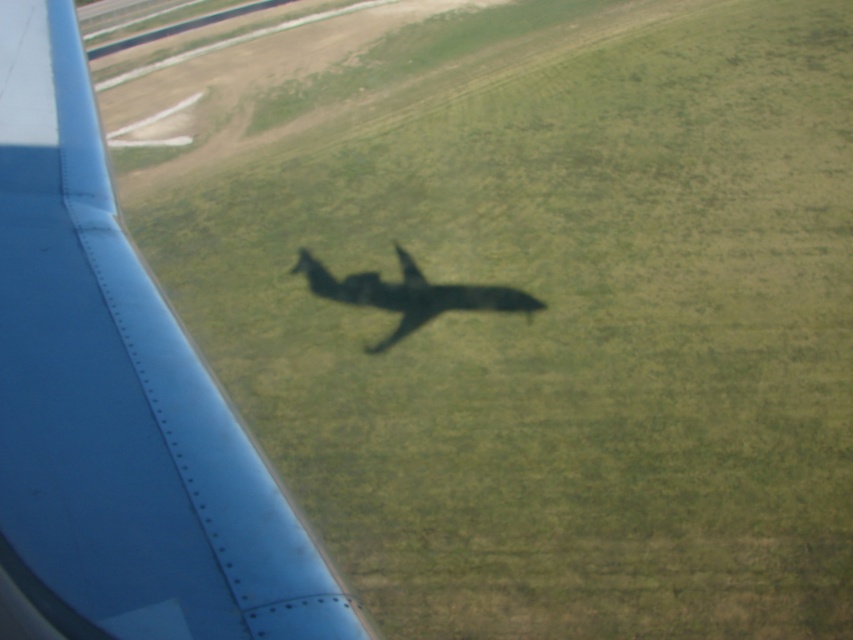
You are a pilot checking the aircraft wing position relative to the ground. According to the coordinates provided, where exactly is the matte blue wing at left located in the image?

The matte blue wing at left is located at coordinates point [119,401].

You are a passenger sitting in the aircraft and looking out the window. You notice two points marked on the window at coordinates point (44, 465) and point (502, 310). Which point is closer to the front of the aircraft?

Point (44, 465) is in front of point (502, 310), so it is closer to the front of the aircraft.

You are a passenger sitting near the window in an aircraft. You notice two objects outside the window. One is the matte blue wing at left and the other is the shiny metallic airplane at center. Which object is closer to you?

The matte blue wing at left is closer to you because it is in front of the shiny metallic airplane at center.